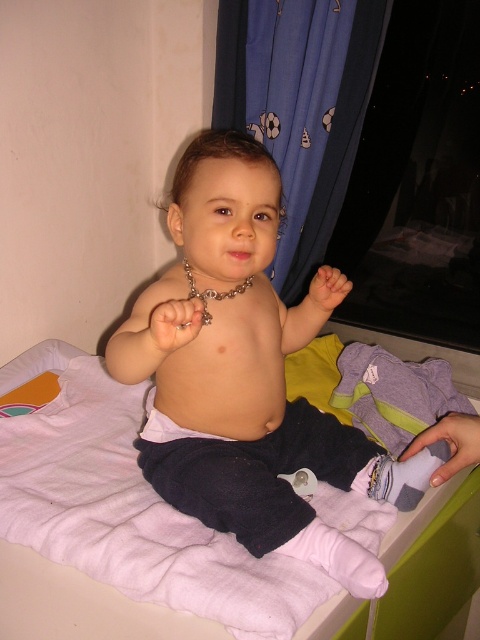
Question: Can you confirm if nude fabric baby at center is positioned to the right of purple soft cloth at center?

Choices:
 (A) yes
 (B) no

Answer: (B)

Question: Does nude fabric baby at center have a smaller size compared to purple soft cloth at center?

Choices:
 (A) no
 (B) yes

Answer: (A)

Question: Among these points, which one is nearest to the camera?

Choices:
 (A) (173, 305)
 (B) (29, 611)

Answer: (A)

Question: Can you confirm if nude fabric baby at center is thinner than purple soft cloth at center?

Choices:
 (A) no
 (B) yes

Answer: (B)

Question: Which point is closer to the camera taking this photo?

Choices:
 (A) (194, 173)
 (B) (51, 566)

Answer: (A)